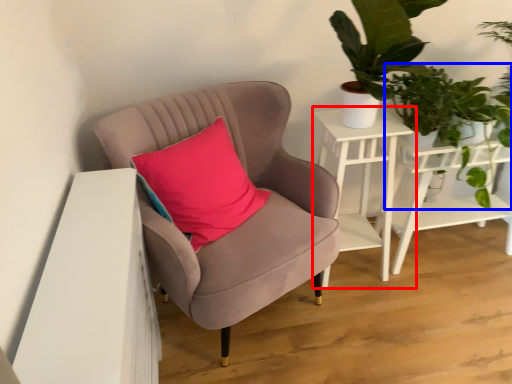
Question: Which object appears farthest to the camera in this image, table (highlighted by a red box) or vegetation (highlighted by a blue box)?

Choices:
 (A) table
 (B) vegetation

Answer: (A)